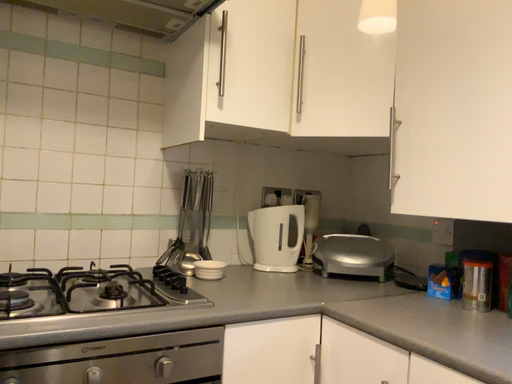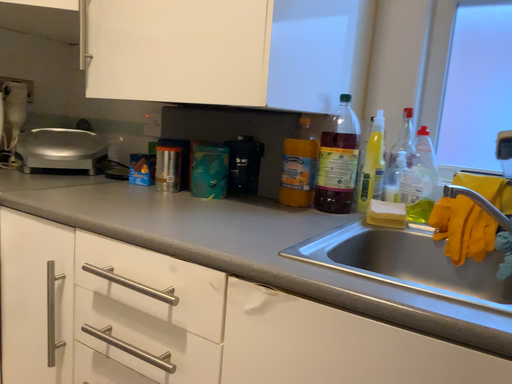
Question: Which way did the camera rotate in the video?

Choices:
 (A) rotated upward
 (B) rotated downward

Answer: (B)